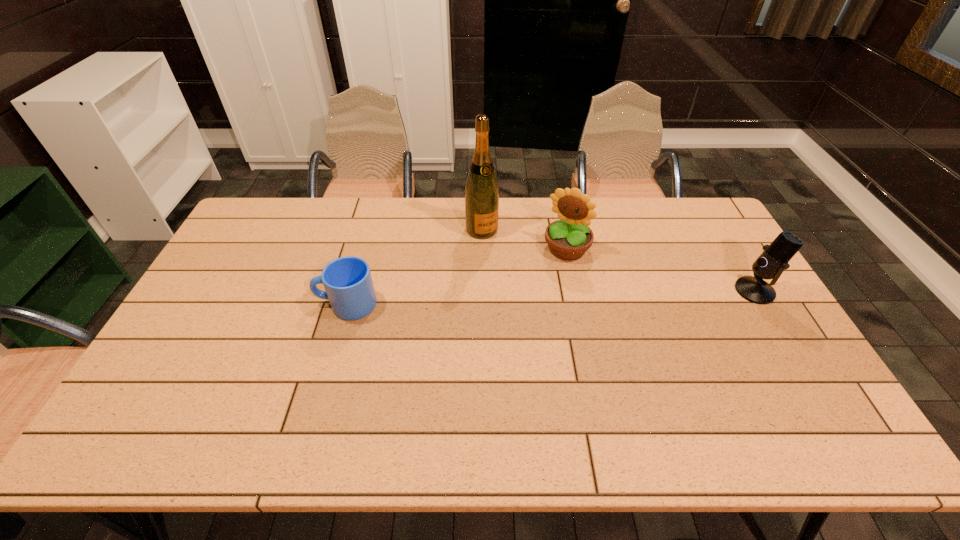
Identify the location of vacant space located 0.290m on the stand of the microphone. (641, 291).

At what (x,y) coordinates should I click in order to perform the action: click on vacant area situated on the stand of the microphone. Please return your answer as a coordinate pair (x, y). The image size is (960, 540). Looking at the image, I should click on (713, 291).

At what (x,y) coordinates should I click in order to perform the action: click on vacant space situated on the face of the second object from right to left. Please return your answer as a coordinate pair (x, y). This screenshot has height=540, width=960. Looking at the image, I should click on (535, 298).

Where is `free space located on the face of the second object from right to left`? The width and height of the screenshot is (960, 540). free space located on the face of the second object from right to left is located at coordinates coord(507,340).

You are a GUI agent. You are given a task and a screenshot of the screen. Output one action in this format:
    pyautogui.click(x=<x>, y=<y>)
    Task: Click on the vacant space situated 0.190m on the face of the second object from right to left
    This screenshot has width=960, height=540.
    Given the screenshot: What is the action you would take?
    pyautogui.click(x=533, y=300)

At what (x,y) coordinates should I click in order to perform the action: click on vacant space located on the front-facing side of the tallest object. Please return your answer as a coordinate pair (x, y). The width and height of the screenshot is (960, 540). Looking at the image, I should click on (518, 283).

Locate an element on the screen. free space located on the front-facing side of the tallest object is located at coordinates (541, 317).

This screenshot has height=540, width=960. I want to click on vacant space located on the front-facing side of the tallest object, so click(x=535, y=308).

You are a GUI agent. You are given a task and a screenshot of the screen. Output one action in this format:
    pyautogui.click(x=<x>, y=<y>)
    Task: Click on the sunflower positioned at the far edge
    This screenshot has height=540, width=960.
    Given the screenshot: What is the action you would take?
    pyautogui.click(x=569, y=238)

Find the location of a particular element. This screenshot has width=960, height=540. wine bottle at the far edge is located at coordinates (481, 190).